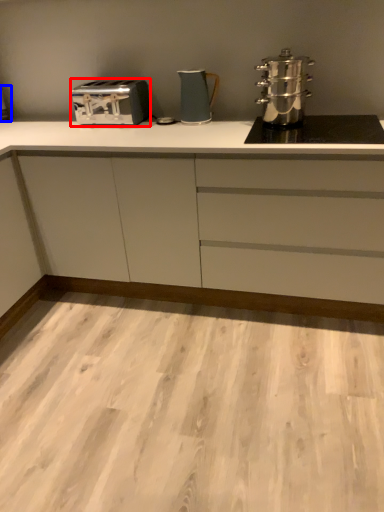
Question: Which object is further to the camera taking this photo, toaster (highlighted by a red box) or appliance (highlighted by a blue box)?

Choices:
 (A) toaster
 (B) appliance

Answer: (B)